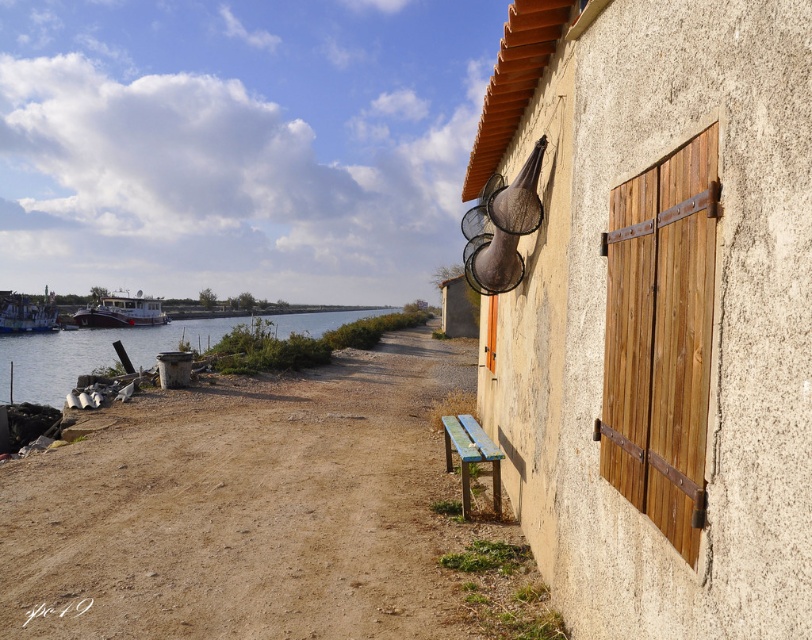
You are standing at the riverside and want to cross to the other side. There is a white glossy boat at left and clear water at lower left. Which one should you use to cross the river?

You should use the white glossy boat at left to cross the river because boats are designed for water travel, while the clear water at lower left is just the body of water itself and cannot be used for crossing.